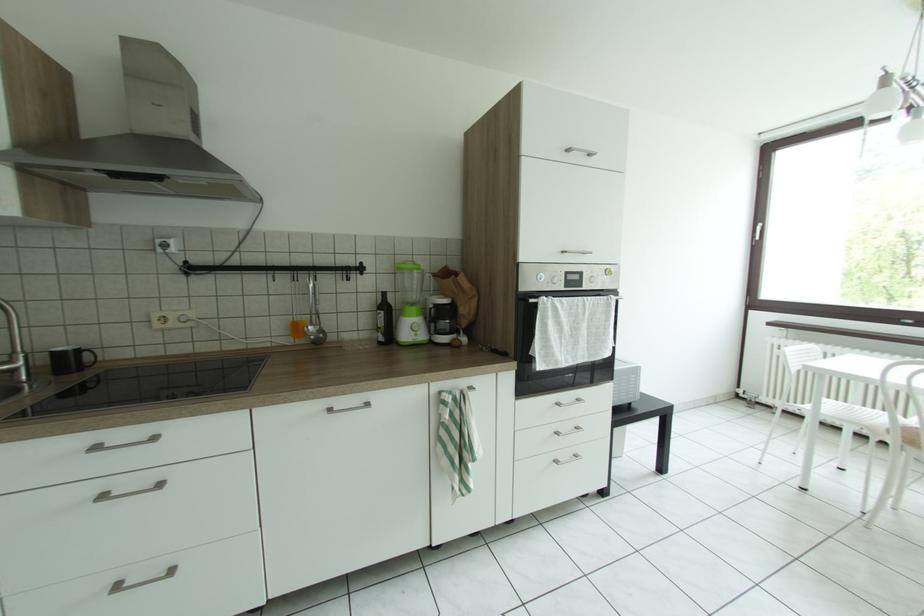
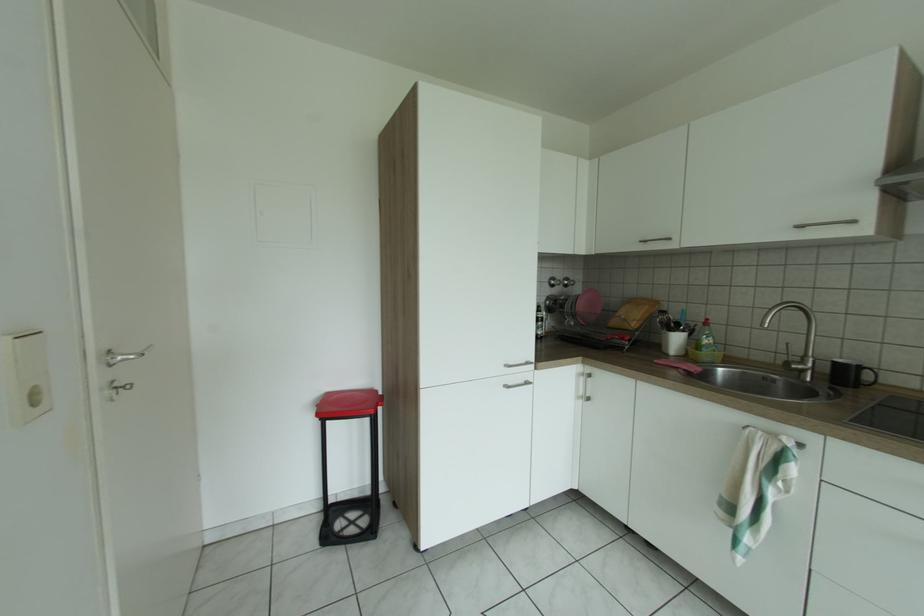
Question: The first image is from the beginning of the video and the second image is from the end. How did the camera likely rotate when shooting the video?

Choices:
 (A) Left
 (B) Right
 (C) Up
 (D) Down

Answer: (A)